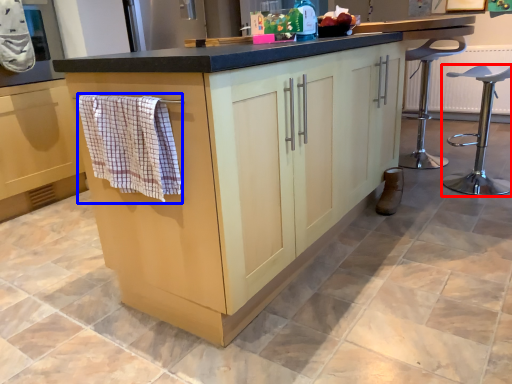
Question: Among these objects, which one is farthest to the camera, furniture (highlighted by a red box) or bath towel (highlighted by a blue box)?

Choices:
 (A) furniture
 (B) bath towel

Answer: (A)